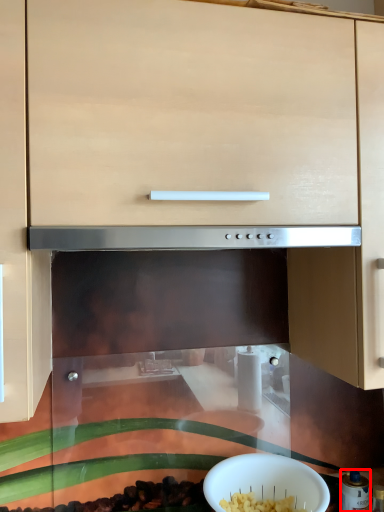
Question: Considering the relative positions of appliance (annotated by the red box) and bowl in the image provided, where is appliance (annotated by the red box) located with respect to the staircase?

Choices:
 (A) left
 (B) right

Answer: (B)